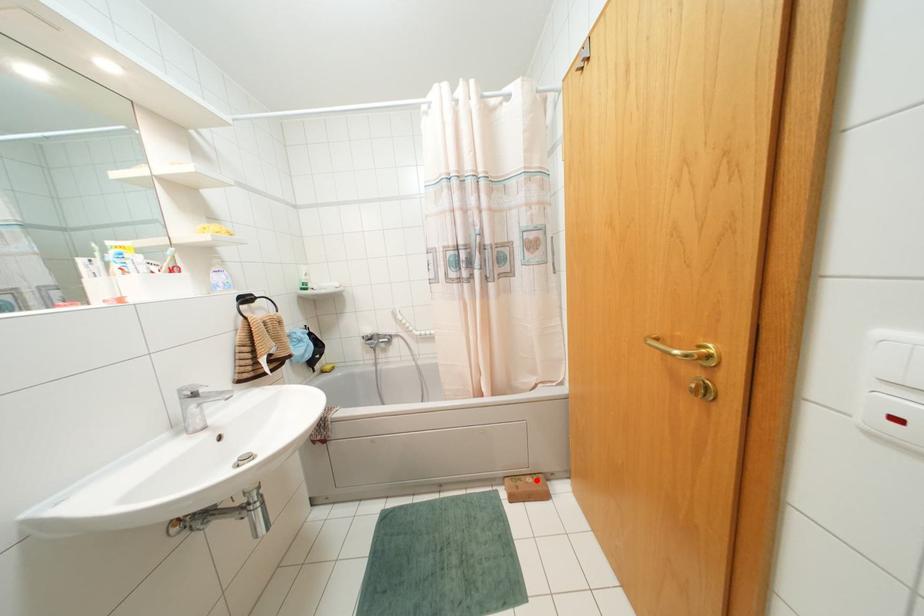
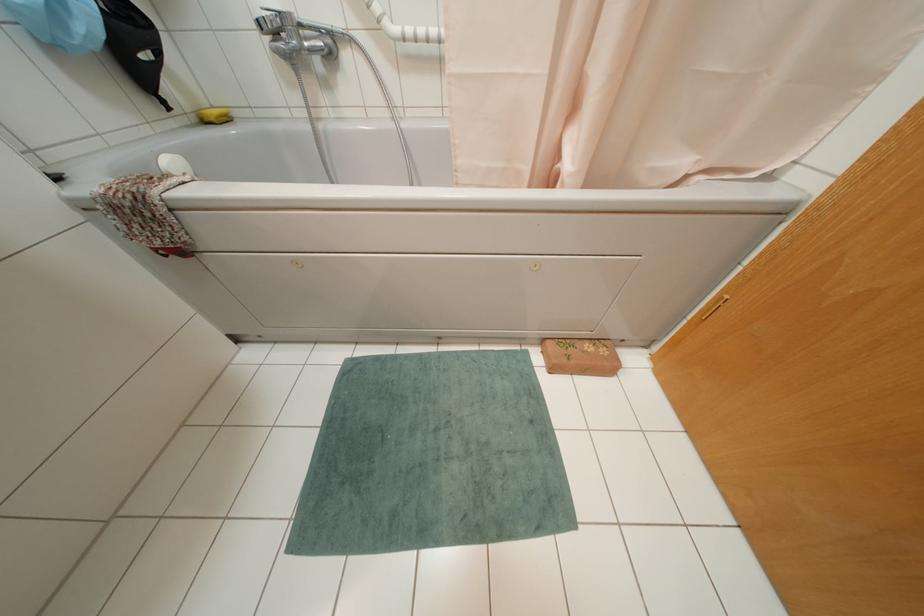
Locate, in the second image, the point that corresponds to the highlighted location in the first image.

(602, 351)